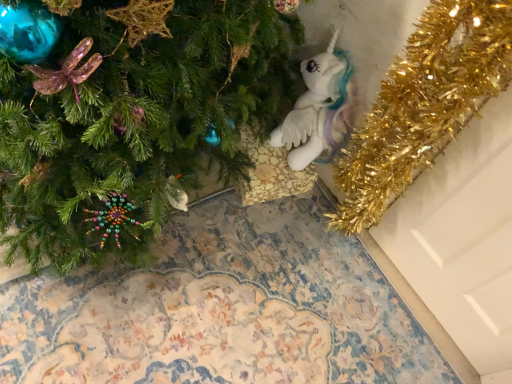
Question: Does green matte christmas tree at lower left contain white plush unicorn at center?

Choices:
 (A) no
 (B) yes

Answer: (A)

Question: From a real-world perspective, is green matte christmas tree at lower left physically above white plush unicorn at center?

Choices:
 (A) no
 (B) yes

Answer: (A)

Question: Is green matte christmas tree at lower left touching white plush unicorn at center?

Choices:
 (A) no
 (B) yes

Answer: (A)

Question: From the image's perspective, does green matte christmas tree at lower left appear higher than white plush unicorn at center?

Choices:
 (A) yes
 (B) no

Answer: (B)

Question: From the image's perspective, is green matte christmas tree at lower left beneath white plush unicorn at center?

Choices:
 (A) no
 (B) yes

Answer: (B)

Question: Does green matte christmas tree at lower left turn towards white plush unicorn at center?

Choices:
 (A) yes
 (B) no

Answer: (B)

Question: Is white plush unicorn at center facing away from green matte christmas tree at lower left?

Choices:
 (A) no
 (B) yes

Answer: (A)

Question: Does white plush unicorn at center have a lesser height compared to green matte christmas tree at lower left?

Choices:
 (A) no
 (B) yes

Answer: (A)

Question: Can you confirm if white plush unicorn at center is smaller than green matte christmas tree at lower left?

Choices:
 (A) no
 (B) yes

Answer: (B)

Question: Is white plush unicorn at center beside green matte christmas tree at lower left?

Choices:
 (A) no
 (B) yes

Answer: (A)

Question: Is the position of white plush unicorn at center less distant than that of green matte christmas tree at lower left?

Choices:
 (A) yes
 (B) no

Answer: (B)

Question: From a real-world perspective, is white plush unicorn at center under green matte christmas tree at lower left?

Choices:
 (A) no
 (B) yes

Answer: (A)

Question: From the image's perspective, relative to white plush unicorn at center, is green matte christmas tree at lower left above or below?

Choices:
 (A) above
 (B) below

Answer: (B)